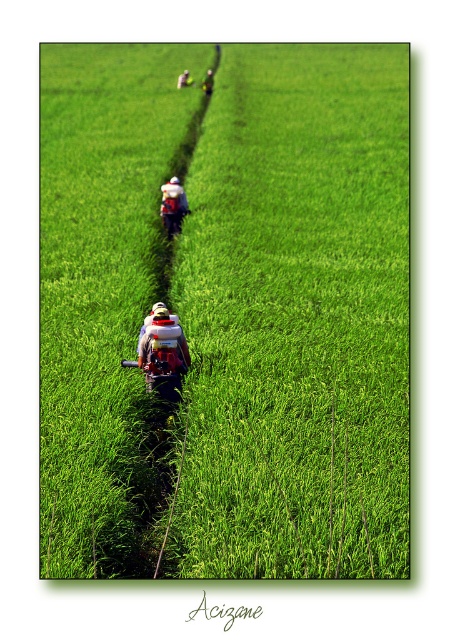
You are a farmer in the rice paddy and need to choose between the metallic red sprayer at center and the green fabric backpack at center to carry a pesticide. Which one can hold more pesticide?

The green fabric backpack at center can hold more pesticide because it is larger in size than the metallic red sprayer at center.

You are a farmer working in the rice paddy field. You need to carry both the metallic red sprayer at center and the camouflage fabric backpack at center. Which one of these two items is narrower in width so that it can fit better in the narrow path between the rice plants?

The metallic red sprayer at center has a lesser width compared to the camouflage fabric backpack at center, so it can fit better in the narrow path between the rice plants.

You are a farmer who needs to carry both the metallic red sprayer at center and the camouflage fabric backpack at center while walking through the rice paddy. Based on their sizes, which item will be easier to carry comfortably?

The metallic red sprayer at center occupies less space than the camouflage fabric backpack at center, so it will be easier to carry comfortably.